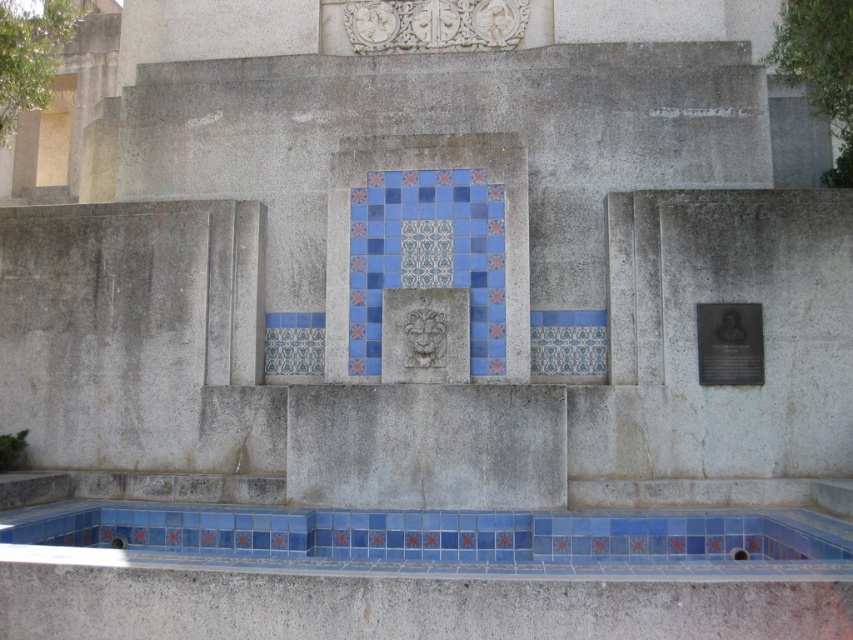
You are standing in front of the stone wall and notice two points marked on it. The first point is at coordinates point (x=840, y=531) and the second is at point (x=697, y=340). Which point is closer to you?

Point (x=840, y=531) is in front of point (x=697, y=340), so the first point is closer to you.

You are a maintenance worker inspecting the stone structure. You need to place a new decorative item that requires a surface area of at least 1.2 square meters. Which object between the blue tile pool at lower center and the black polished metal plaque at right would be suitable for this purpose?

The blue tile pool at lower center is larger in size than the black polished metal plaque at right, so it would be suitable for placing the decorative item requiring at least 1.2 square meters of surface area.

You are a maintenance worker inspecting the stone structure. You need to access the blue tile pool at lower center to clean it. The black polished metal plaque at right is in your way. Can you move the plaque to the side to reach the pool?

The blue tile pool at lower center is positioned under the black polished metal plaque at right, so you cannot move the plaque to the side to reach the pool because the plaque is above the pool and not blocking access from the sides.